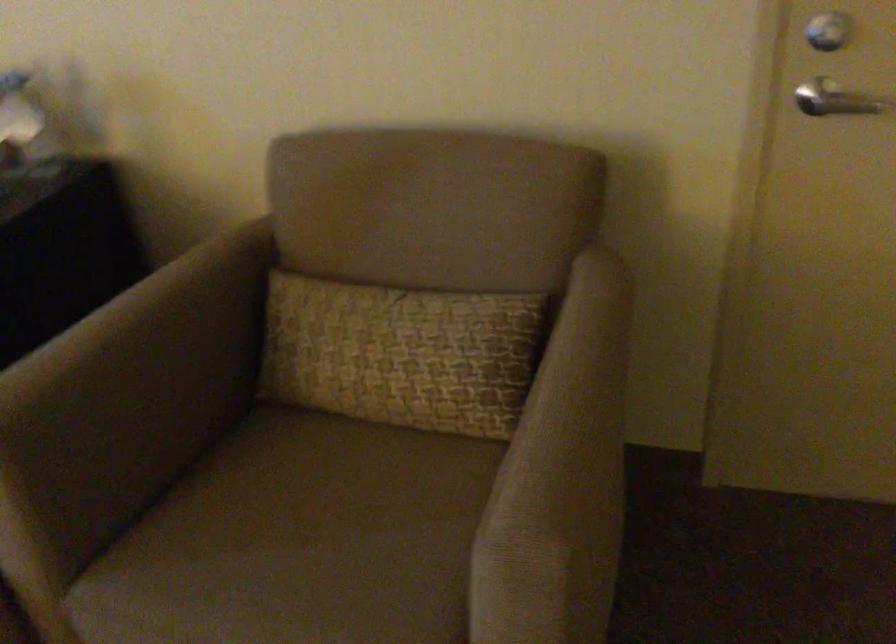
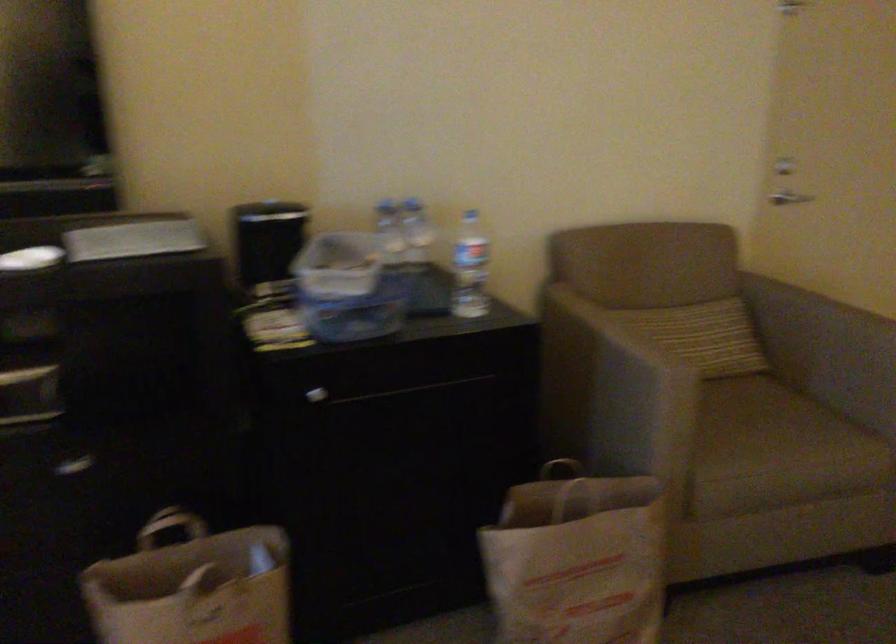
Find the pixel in the second image that matches (x=519, y=368) in the first image.

(807, 308)